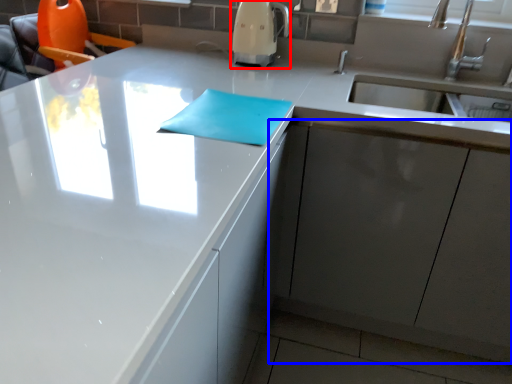
Question: Which object is further to the camera taking this photo, coffee machine (highlighted by a red box) or cabinetry (highlighted by a blue box)?

Choices:
 (A) coffee machine
 (B) cabinetry

Answer: (A)